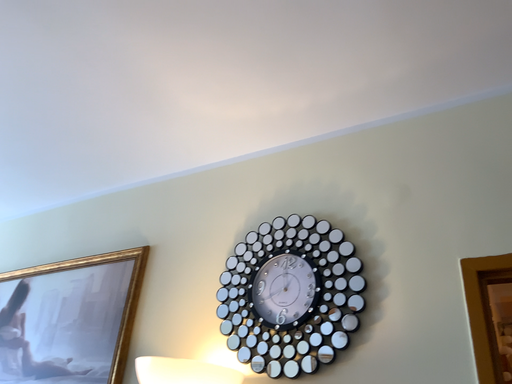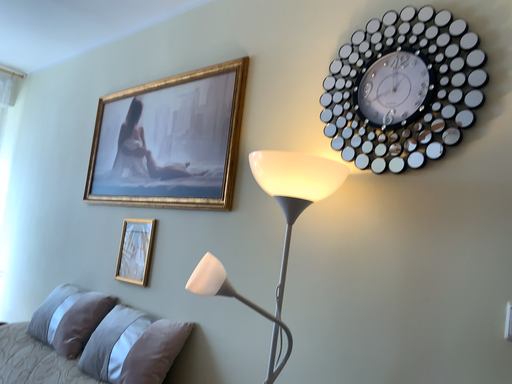
Question: Which way did the camera rotate in the video?

Choices:
 (A) rotated downward
 (B) rotated upward

Answer: (A)